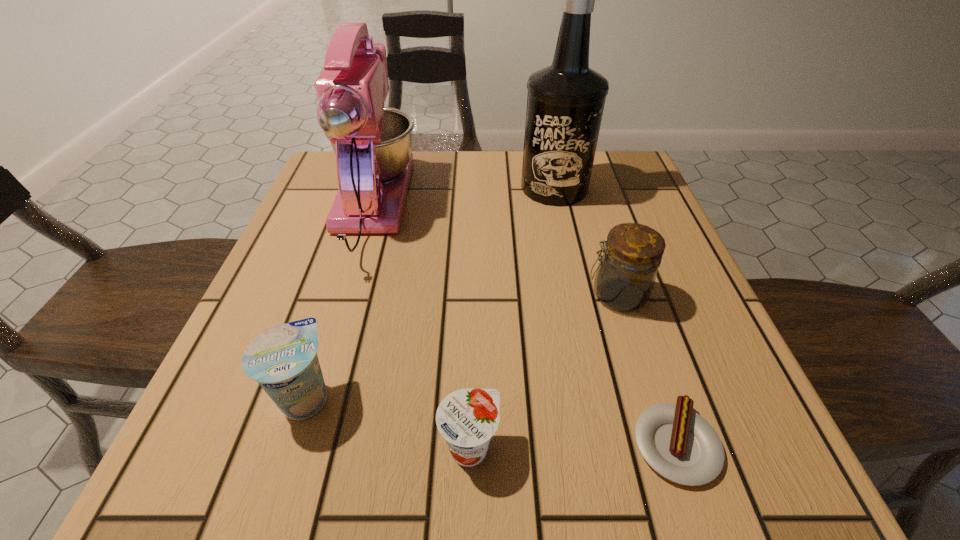
Identify the location of vacant space located 0.090m on the lid of the jar. (536, 295).

At what (x,y) coordinates should I click in order to perform the action: click on vacant space located 0.230m on the lid of the jar. Please return your answer as a coordinate pair (x, y). Looking at the image, I should click on (457, 295).

You are a GUI agent. You are given a task and a screenshot of the screen. Output one action in this format:
    pyautogui.click(x=<x>, y=<y>)
    Task: Click on the vacant region located on the right of the left yogurt
    The image size is (960, 540).
    Given the screenshot: What is the action you would take?
    pyautogui.click(x=545, y=397)

What are the coordinates of `blank space located 0.110m on the left of the second shortest object` in the screenshot? It's located at (357, 448).

Where is `vacant space situated 0.170m on the left of the shortest object`? This screenshot has width=960, height=540. vacant space situated 0.170m on the left of the shortest object is located at coordinates (506, 443).

The height and width of the screenshot is (540, 960). Identify the location of liquor positioned at the far edge. (565, 102).

The height and width of the screenshot is (540, 960). Identify the location of mixer present at the far edge. (372, 143).

Locate an element on the screen. sausage situated at the near edge is located at coordinates (679, 444).

At what (x,y) coordinates should I click in order to perform the action: click on mixer situated at the left edge. Please return your answer as a coordinate pair (x, y). This screenshot has height=540, width=960. Looking at the image, I should click on (372, 143).

Where is `yogurt that is at the left edge`? This screenshot has height=540, width=960. yogurt that is at the left edge is located at coordinates coord(283,359).